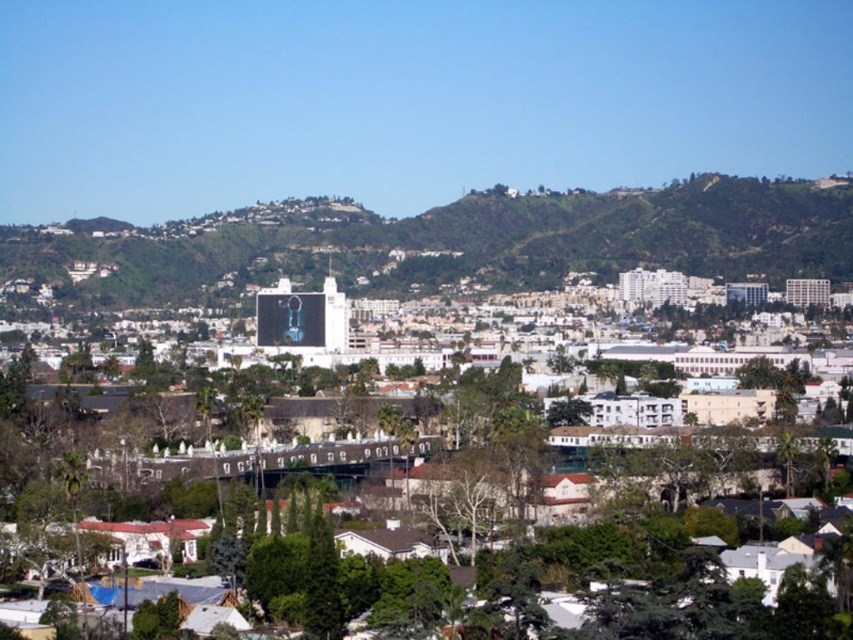
Question: Among these points, which one is farthest from the camera?

Choices:
 (A) (119, 284)
 (B) (16, 470)

Answer: (A)

Question: Which object is farther from the camera taking this photo?

Choices:
 (A) green leafy tree at center
 (B) green grassy hill at center

Answer: (A)

Question: Does green grassy hill at center have a smaller size compared to green leafy tree at center?

Choices:
 (A) yes
 (B) no

Answer: (A)

Question: Is green grassy hill at center to the left of green leafy tree at center from the viewer's perspective?

Choices:
 (A) yes
 (B) no

Answer: (B)

Question: Can you confirm if green grassy hill at center is smaller than green leafy tree at center?

Choices:
 (A) yes
 (B) no

Answer: (A)